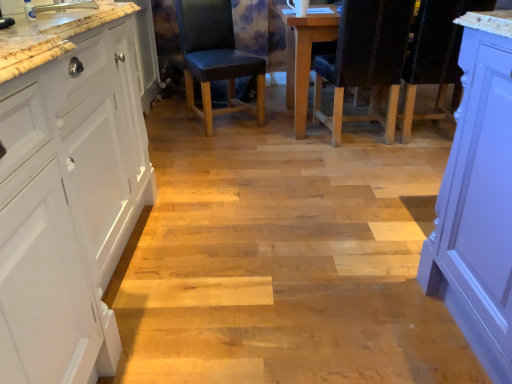
Find the location of a particular element. The width and height of the screenshot is (512, 384). free space between black leather chair at center, arranged as the first chair when viewed from the right, and white matte cabinet at left is located at coordinates (258, 199).